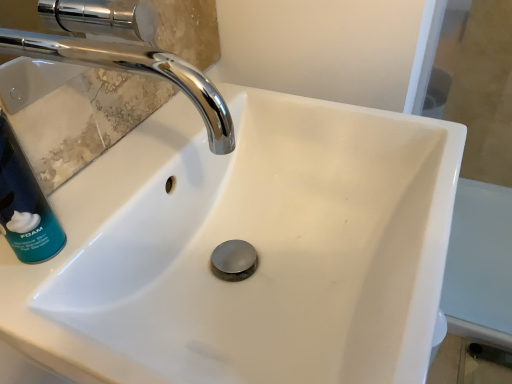
Question: From the image's perspective, is teal matte shaving cream can at left beneath chrome/metallic faucet at upper left?

Choices:
 (A) no
 (B) yes

Answer: (B)

Question: From the image's perspective, is teal matte shaving cream can at left on chrome/metallic faucet at upper left?

Choices:
 (A) no
 (B) yes

Answer: (A)

Question: Considering the relative sizes of teal matte shaving cream can at left and chrome/metallic faucet at upper left in the image provided, is teal matte shaving cream can at left shorter than chrome/metallic faucet at upper left?

Choices:
 (A) yes
 (B) no

Answer: (B)

Question: Is teal matte shaving cream can at left positioned far away from chrome/metallic faucet at upper left?

Choices:
 (A) yes
 (B) no

Answer: (B)

Question: Is teal matte shaving cream can at left closer to camera compared to chrome/metallic faucet at upper left?

Choices:
 (A) yes
 (B) no

Answer: (B)

Question: Does teal matte shaving cream can at left have a greater width compared to chrome/metallic faucet at upper left?

Choices:
 (A) no
 (B) yes

Answer: (A)

Question: Can you confirm if chrome/metallic faucet at upper left is taller than teal matte shaving cream can at left?

Choices:
 (A) no
 (B) yes

Answer: (A)

Question: Can you confirm if chrome/metallic faucet at upper left is shorter than teal matte shaving cream can at left?

Choices:
 (A) no
 (B) yes

Answer: (B)

Question: Is chrome/metallic faucet at upper left positioned with its back to teal matte shaving cream can at left?

Choices:
 (A) yes
 (B) no

Answer: (B)

Question: Is chrome/metallic faucet at upper left aimed at teal matte shaving cream can at left?

Choices:
 (A) no
 (B) yes

Answer: (A)

Question: Considering the relative sizes of chrome/metallic faucet at upper left and teal matte shaving cream can at left in the image provided, is chrome/metallic faucet at upper left smaller than teal matte shaving cream can at left?

Choices:
 (A) yes
 (B) no

Answer: (B)

Question: Considering the relative sizes of chrome/metallic faucet at upper left and teal matte shaving cream can at left in the image provided, is chrome/metallic faucet at upper left wider than teal matte shaving cream can at left?

Choices:
 (A) yes
 (B) no

Answer: (A)

Question: Looking at their shapes, would you say chrome/metallic faucet at upper left is wider or thinner than teal matte shaving cream can at left?

Choices:
 (A) thin
 (B) wide

Answer: (B)